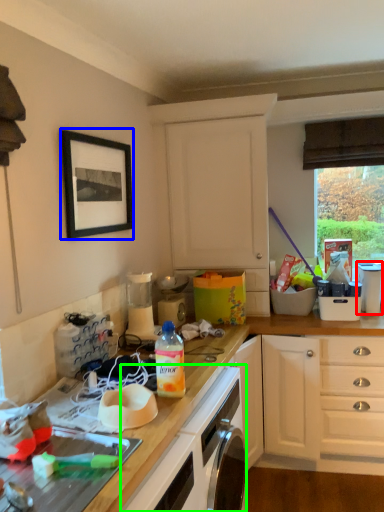
Question: Which is nearer to the appliance (highlighted by a red box)? picture frame (highlighted by a blue box) or oven (highlighted by a green box).

Choices:
 (A) picture frame
 (B) oven

Answer: (B)